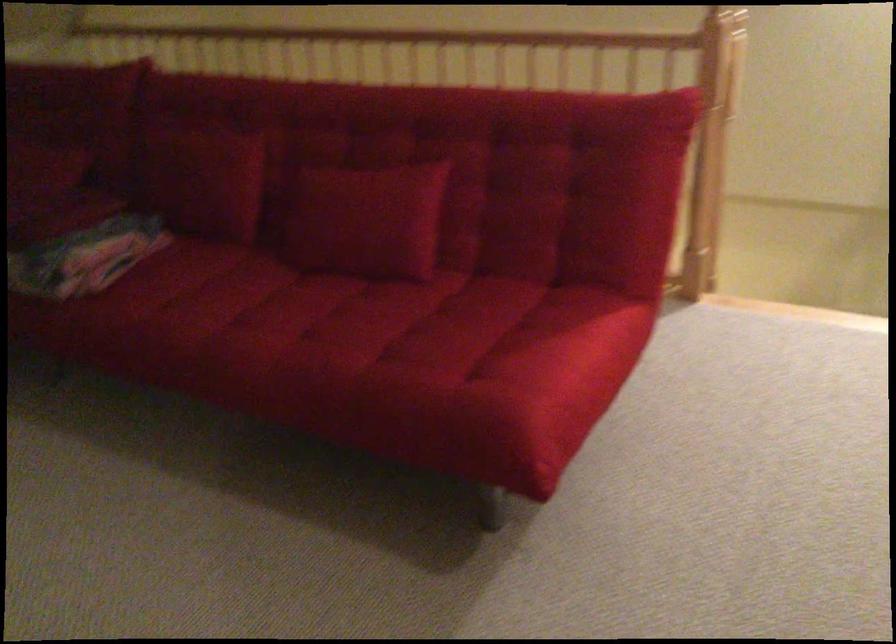
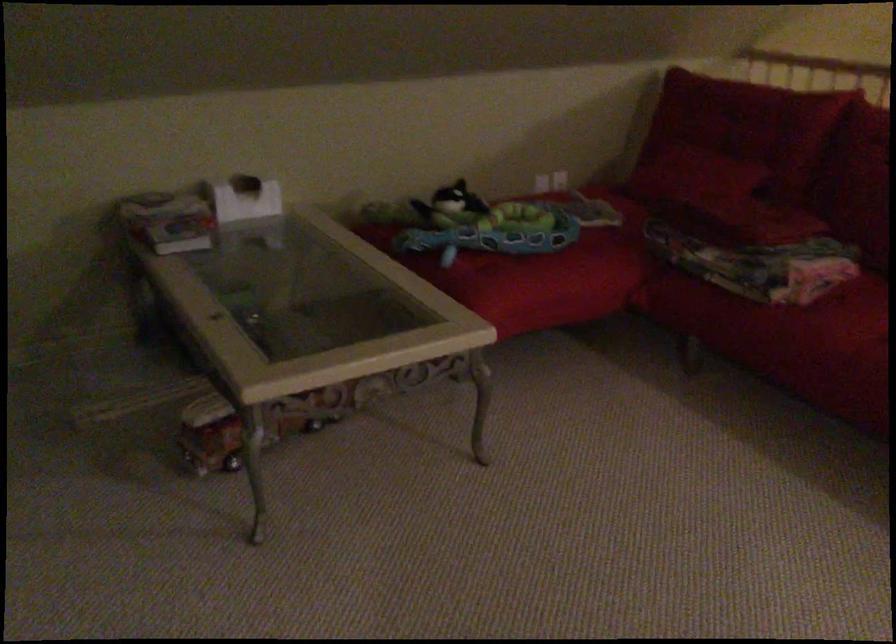
The point at (x=133, y=301) is marked in the first image. Where is the corresponding point in the second image?

(843, 317)